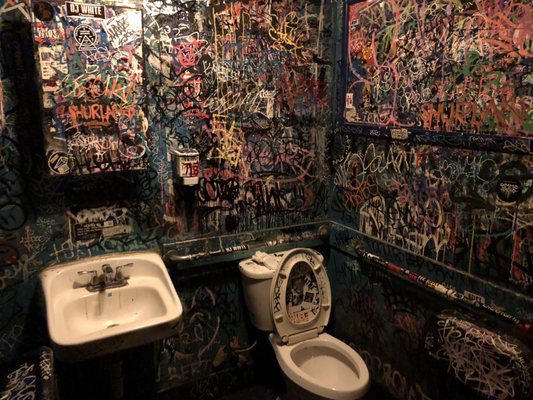
Where is `front of toilet bowl rim`? The height and width of the screenshot is (400, 533). front of toilet bowl rim is located at coordinates (352, 394).